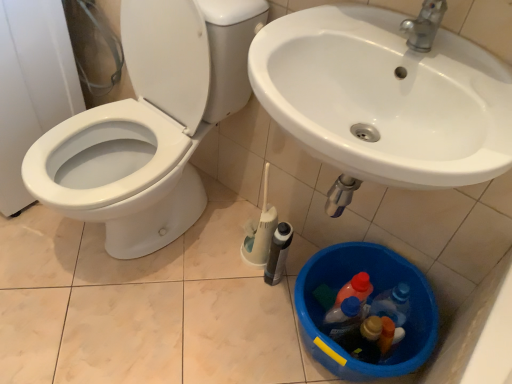
Locate an element on the screen. The width and height of the screenshot is (512, 384). blue plastic bucket at lower center is located at coordinates (369, 303).

Describe the element at coordinates (369, 303) in the screenshot. The width and height of the screenshot is (512, 384). I see `blue plastic bucket at lower center` at that location.

Describe the element at coordinates (150, 124) in the screenshot. I see `white glossy toilet at left` at that location.

Measure the distance between point (143, 217) and camera.

The depth of point (143, 217) is 1.32 meters.

What is the approximate height of white glossy toilet at left?

white glossy toilet at left is 32.90 inches in height.

At what (x,y) coordinates should I click in order to perform the action: click on white glossy toilet at left. Please return your answer as a coordinate pair (x, y). The image size is (512, 384). Looking at the image, I should click on (150, 124).

Locate an element on the screen. blue plastic bucket at lower center is located at coordinates (369, 303).

Consider the image. Which object is positioned more to the left, blue plastic bucket at lower center or white glossy toilet at left?

Positioned to the left is white glossy toilet at left.

Between blue plastic bucket at lower center and white glossy toilet at left, which one is positioned behind?

blue plastic bucket at lower center is further away from the camera.

Which is in front, point (419, 353) or point (159, 92)?

The point (419, 353) is more forward.

From the image's perspective, does blue plastic bucket at lower center appear higher than white glossy toilet at left?

No.

Based on the photo, from a real-world perspective, is blue plastic bucket at lower center physically located above or below white glossy toilet at left?

In terms of real-world spatial position, blue plastic bucket at lower center is below white glossy toilet at left.

Which object is wider, blue plastic bucket at lower center or white glossy toilet at left?

With larger width is white glossy toilet at left.

Can you confirm if blue plastic bucket at lower center is taller than white glossy toilet at left?

No, blue plastic bucket at lower center is not taller than white glossy toilet at left.

Who is smaller, blue plastic bucket at lower center or white glossy toilet at left?

With smaller size is blue plastic bucket at lower center.

Is blue plastic bucket at lower center not within white glossy toilet at left?

That's correct, blue plastic bucket at lower center is outside of white glossy toilet at left.

Are blue plastic bucket at lower center and white glossy toilet at left far apart?

No, blue plastic bucket at lower center is in close proximity to white glossy toilet at left.

Looking at this image, is white glossy toilet at left at the back of blue plastic bucket at lower center?

blue plastic bucket at lower center does not have its back to white glossy toilet at left.

What's the angular difference between blue plastic bucket at lower center and white glossy toilet at left's facing directions?

They differ by 0.000825 degrees in their facing directions.

This screenshot has width=512, height=384. I want to click on toilet on the left of blue plastic bucket at lower center, so click(150, 124).

Does white glossy toilet at left appear on the left side of blue plastic bucket at lower center?

Indeed, white glossy toilet at left is positioned on the left side of blue plastic bucket at lower center.

Considering the positions of objects white glossy toilet at left and blue plastic bucket at lower center in the image provided, who is in front, white glossy toilet at left or blue plastic bucket at lower center?

white glossy toilet at left.

Does point (119, 137) come farther from viewer compared to point (310, 283)?

No, (119, 137) is closer to viewer.

From the image's perspective, which is above, white glossy toilet at left or blue plastic bucket at lower center?

white glossy toilet at left is shown above in the image.

From a real-world perspective, is white glossy toilet at left under blue plastic bucket at lower center?

No, from a real-world perspective, white glossy toilet at left is not below blue plastic bucket at lower center.

Considering the sizes of white glossy toilet at left and blue plastic bucket at lower center in the image, is white glossy toilet at left wider or thinner than blue plastic bucket at lower center?

Considering their sizes, white glossy toilet at left looks broader than blue plastic bucket at lower center.

Can you confirm if white glossy toilet at left is taller than blue plastic bucket at lower center?

Indeed, white glossy toilet at left has a greater height compared to blue plastic bucket at lower center.

Can you confirm if white glossy toilet at left is smaller than blue plastic bucket at lower center?

Incorrect, white glossy toilet at left is not smaller in size than blue plastic bucket at lower center.

Do you think white glossy toilet at left is within blue plastic bucket at lower center, or outside of it?

white glossy toilet at left is outside blue plastic bucket at lower center.

Are white glossy toilet at left and blue plastic bucket at lower center making contact?

No, white glossy toilet at left is not touching blue plastic bucket at lower center.

Is white glossy toilet at left positioned with its back to blue plastic bucket at lower center?

No, white glossy toilet at left's orientation is not away from blue plastic bucket at lower center.

From the picture: How many degrees apart are the facing directions of white glossy toilet at left and blue plastic bucket at lower center?

The angle between the facing direction of white glossy toilet at left and the facing direction of blue plastic bucket at lower center is 0.000825 degrees.

The image size is (512, 384). I want to click on potty behind the white glossy toilet at left, so click(x=369, y=303).

Image resolution: width=512 pixels, height=384 pixels. I want to click on potty below the white glossy toilet at left (from a real-world perspective), so click(x=369, y=303).

I want to click on toilet located in front of the blue plastic bucket at lower center, so click(x=150, y=124).